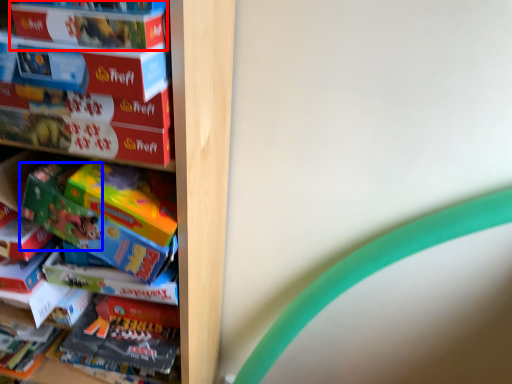
Question: Which point is closer to the camera, paperback book (highlighted by a red box) or toy (highlighted by a blue box)?

Choices:
 (A) paperback book
 (B) toy

Answer: (A)